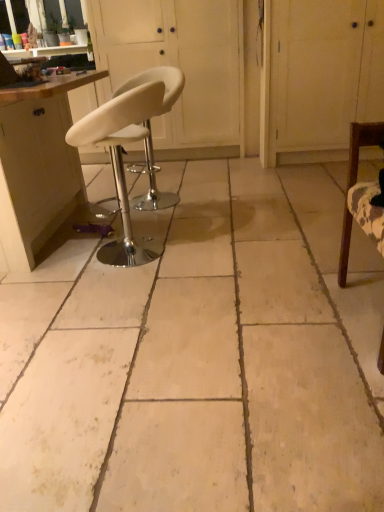
This screenshot has width=384, height=512. I want to click on vacant area that lies between white leather stool at center, the third chair positioned from the front, and wooden chair at right, which ranks as the third chair in back-to-front order, so click(x=248, y=253).